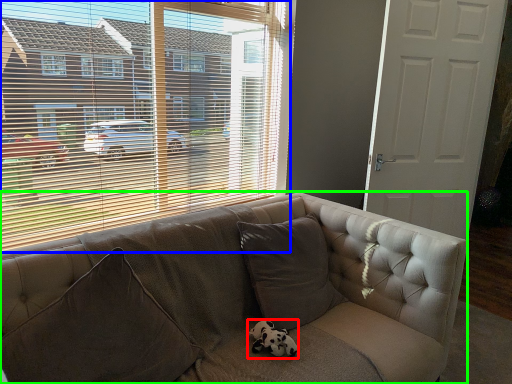
Question: Which object is the closest to the animal (highlighted by a red box)? Choose among these: window (highlighted by a blue box) or studio couch (highlighted by a green box).

Choices:
 (A) window
 (B) studio couch

Answer: (B)